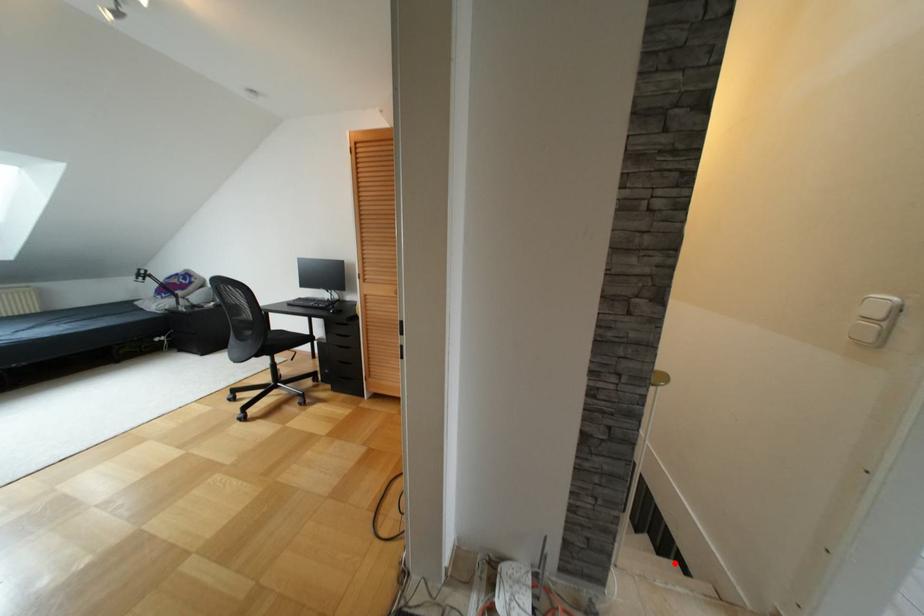
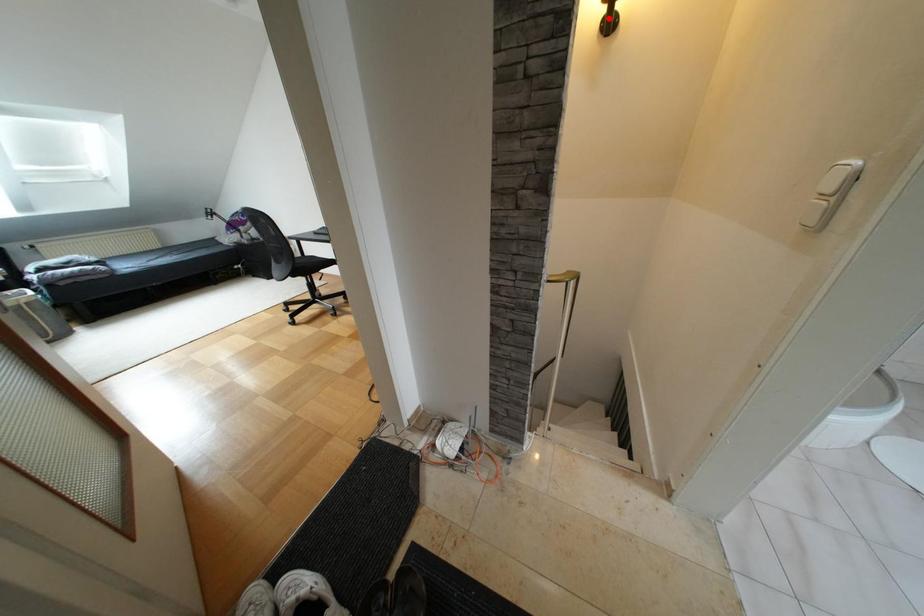
I am providing you with two images of the same scene from different viewpoints. A red point is marked on the first image and another point is marked on the second image. Is the marked point in image1 the same physical position as the marked point in image2?

No